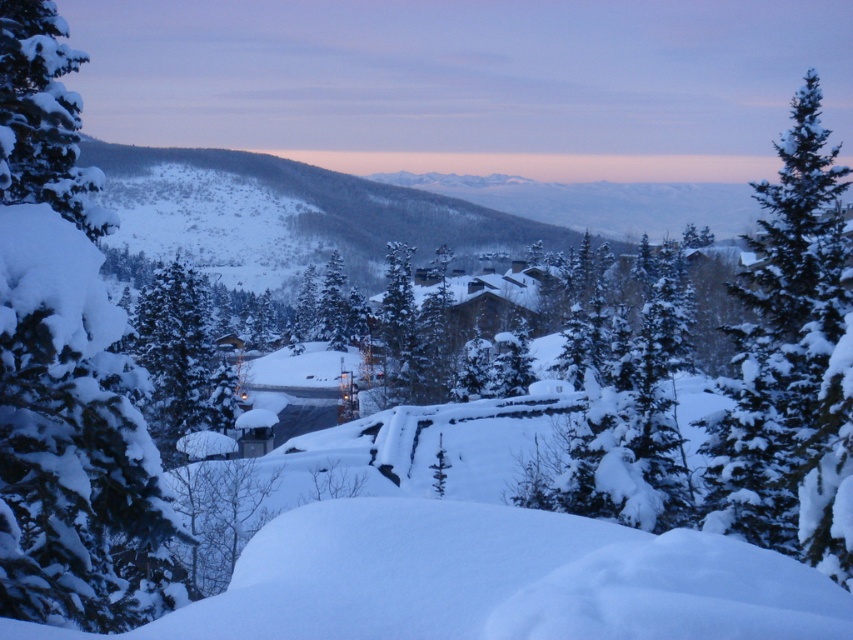
Can you confirm if snow-covered evergreen at left is bigger than snow-covered evergreen at center-right?

No.

Can you confirm if snow-covered evergreen at left is positioned below snow-covered evergreen at center-right?

Correct, snow-covered evergreen at left is located below snow-covered evergreen at center-right.

Find the location of a particular element. This screenshot has width=853, height=640. snow-covered evergreen at left is located at coordinates (67, 368).